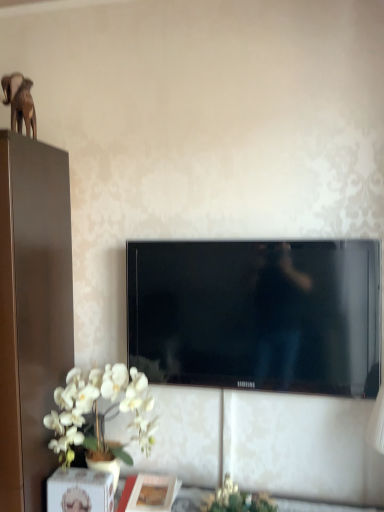
At what (x,y) coordinates should I click in order to perform the action: click on matte white picture frame at lower center. Please return your answer as a coordinate pair (x, y). The width and height of the screenshot is (384, 512). Looking at the image, I should click on (153, 493).

Measure the distance between white matte orchid at lower left and camera.

white matte orchid at lower left is 1.55 meters from camera.

Measure the distance between point (125, 403) and camera.

Point (125, 403) and camera are 5.45 feet apart from each other.

What is the approximate height of black glossy tv at center?

The height of black glossy tv at center is 23.72 inches.

Identify the location of matte white picture frame at lower center. The image size is (384, 512). (153, 493).

Which is in front, green leafy plant at lower center or matte white picture frame at lower center?

Positioned in front is green leafy plant at lower center.

Who is shorter, green leafy plant at lower center or matte white picture frame at lower center?

matte white picture frame at lower center.

Considering the relative sizes of green leafy plant at lower center and matte white picture frame at lower center in the image provided, is green leafy plant at lower center wider than matte white picture frame at lower center?

Yes.

Locate an element on the screen. This screenshot has height=512, width=384. picture frame lying behind the green leafy plant at lower center is located at coordinates (153, 493).

From the image's perspective, would you say brown matte elephant at upper left is positioned over matte white picture frame at lower center?

Yes, from the image's perspective, brown matte elephant at upper left is above matte white picture frame at lower center.

From a real-world perspective, who is located lower, brown matte elephant at upper left or matte white picture frame at lower center?

matte white picture frame at lower center, from a real-world perspective.

Is brown matte elephant at upper left taller than matte white picture frame at lower center?

Indeed, brown matte elephant at upper left has a greater height compared to matte white picture frame at lower center.

Could you tell me if brown matte elephant at upper left is turned towards matte white picture frame at lower center?

No, brown matte elephant at upper left is not aimed at matte white picture frame at lower center.

From the image's perspective, is green leafy plant at lower center on brown matte elephant at upper left?

Incorrect, from the image's perspective, green leafy plant at lower center is lower than brown matte elephant at upper left.

Is green leafy plant at lower center shorter than brown matte elephant at upper left?

Yes.

Could you tell me if green leafy plant at lower center is facing brown matte elephant at upper left?

No, green leafy plant at lower center is not oriented towards brown matte elephant at upper left.

Is green leafy plant at lower center spatially inside brown matte elephant at upper left, or outside of it?

green leafy plant at lower center is not enclosed by brown matte elephant at upper left.

Which is behind, point (104, 420) or point (32, 106)?

The point (32, 106) is farther.

Is white matte orchid at lower left not within brown matte elephant at upper left?

Indeed, white matte orchid at lower left is completely outside brown matte elephant at upper left.

Is white matte orchid at lower left turned away from brown matte elephant at upper left?

white matte orchid at lower left is not turned away from brown matte elephant at upper left.

Is black glossy tv at center to the right of green leafy plant at lower center from the viewer's perspective?

Yes, black glossy tv at center is to the right of green leafy plant at lower center.

In the scene shown: Can you tell me how much black glossy tv at center and green leafy plant at lower center differ in facing direction?

The facing directions of black glossy tv at center and green leafy plant at lower center are 1.11e-05 degrees apart.

Could you tell me if black glossy tv at center is turned towards green leafy plant at lower center?

No, black glossy tv at center does not turn towards green leafy plant at lower center.

Between point (352, 377) and point (227, 496), which one is positioned in front?

The point (227, 496) is in front.

Is white matte orchid at lower left oriented away from green leafy plant at lower center?

That's not correct — white matte orchid at lower left is not looking away from green leafy plant at lower center.

In terms of size, does white matte orchid at lower left appear bigger or smaller than green leafy plant at lower center?

white matte orchid at lower left is bigger than green leafy plant at lower center.

Is white matte orchid at lower left spatially inside green leafy plant at lower center, or outside of it?

white matte orchid at lower left is outside green leafy plant at lower center.

From a real-world perspective, between black glossy tv at center and white matte orchid at lower left, who is vertically higher?

black glossy tv at center, from a real-world perspective.

In the scene shown: Is black glossy tv at center closer to camera compared to white matte orchid at lower left?

No, black glossy tv at center is further to the viewer.

Choose the correct answer: Is black glossy tv at center inside white matte orchid at lower left or outside it?

black glossy tv at center lies outside white matte orchid at lower left.

Identify the location of picture frame on the left of green leafy plant at lower center. (153, 493).

Where is `picture frame lying on the right of brown matte elephant at upper left`? The width and height of the screenshot is (384, 512). picture frame lying on the right of brown matte elephant at upper left is located at coordinates (153, 493).

Which object lies further to the anchor point brown matte elephant at upper left, white matte orchid at lower left or green leafy plant at lower center?

green leafy plant at lower center.

Considering their positions, is matte white picture frame at lower center positioned further to white matte orchid at lower left than brown matte elephant at upper left?

brown matte elephant at upper left is further to white matte orchid at lower left.

Considering their positions, is white matte orchid at lower left positioned closer to green leafy plant at lower center than matte white picture frame at lower center?

Among the two, matte white picture frame at lower center is located nearer to green leafy plant at lower center.

Looking at the image, which one is located further to black glossy tv at center, matte white picture frame at lower center or white matte orchid at lower left?

The object further to black glossy tv at center is matte white picture frame at lower center.

From the image, which object appears to be nearer to brown matte elephant at upper left, matte white picture frame at lower center or black glossy tv at center?

black glossy tv at center is closer to brown matte elephant at upper left.

When comparing their distances from black glossy tv at center, does white matte orchid at lower left or green leafy plant at lower center seem further?

Among the two, green leafy plant at lower center is located further to black glossy tv at center.

When comparing their distances from black glossy tv at center, does white matte orchid at lower left or brown matte elephant at upper left seem further?

brown matte elephant at upper left lies further to black glossy tv at center than the other object.

From the image, which object appears to be farther from green leafy plant at lower center, brown matte elephant at upper left or matte white picture frame at lower center?

brown matte elephant at upper left lies further to green leafy plant at lower center than the other object.

Find the location of a particular element. flower between black glossy tv at center and matte white picture frame at lower center in the up-down direction is located at coordinates (97, 412).

At what (x,y) coordinates should I click in order to perform the action: click on picture frame situated between white matte orchid at lower left and green leafy plant at lower center from left to right. Please return your answer as a coordinate pair (x, y). The image size is (384, 512). Looking at the image, I should click on (153, 493).

The image size is (384, 512). In order to click on flower between brown matte elephant at upper left and matte white picture frame at lower center vertically in this screenshot , I will do (97, 412).

The image size is (384, 512). Find the location of `flower between brown matte elephant at upper left and green leafy plant at lower center in the vertical direction`. flower between brown matte elephant at upper left and green leafy plant at lower center in the vertical direction is located at coordinates (97, 412).